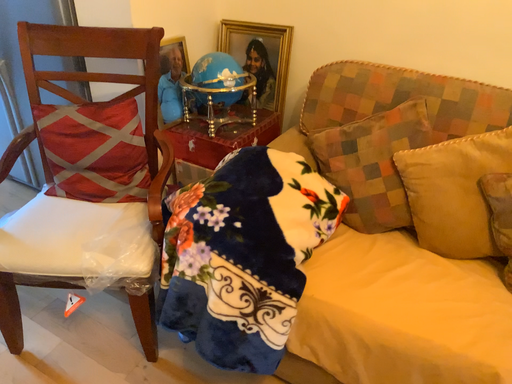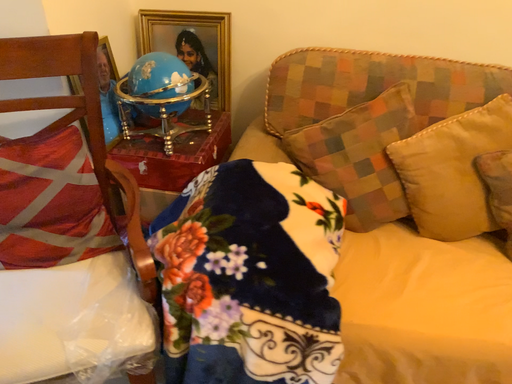
Question: How did the camera likely rotate when shooting the video?

Choices:
 (A) rotated right
 (B) rotated left

Answer: (A)